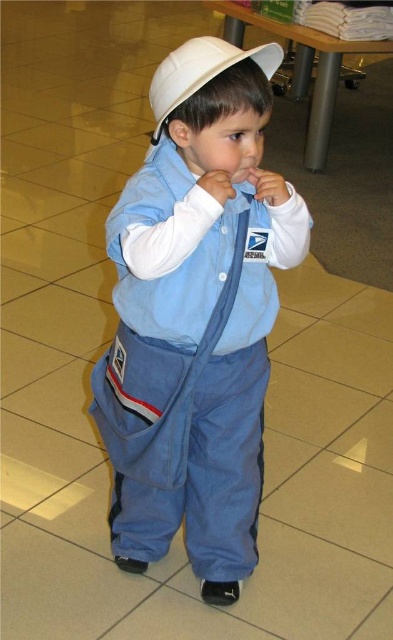
Question: Observing the image, what is the correct spatial positioning of blue denim jumpsuit at center in reference to white matte baseball hat at center?

Choices:
 (A) above
 (B) below

Answer: (B)

Question: Does blue denim jumpsuit at center have a lesser width compared to white matte baseball hat at center?

Choices:
 (A) no
 (B) yes

Answer: (A)

Question: Among these points, which one is nearest to the camera?

Choices:
 (A) (167, 90)
 (B) (163, 100)

Answer: (A)

Question: Which point is closer to the camera?

Choices:
 (A) (168, 61)
 (B) (238, 189)

Answer: (A)

Question: Can you confirm if blue denim jumpsuit at center is thinner than white matte baseball hat at center?

Choices:
 (A) yes
 (B) no

Answer: (B)